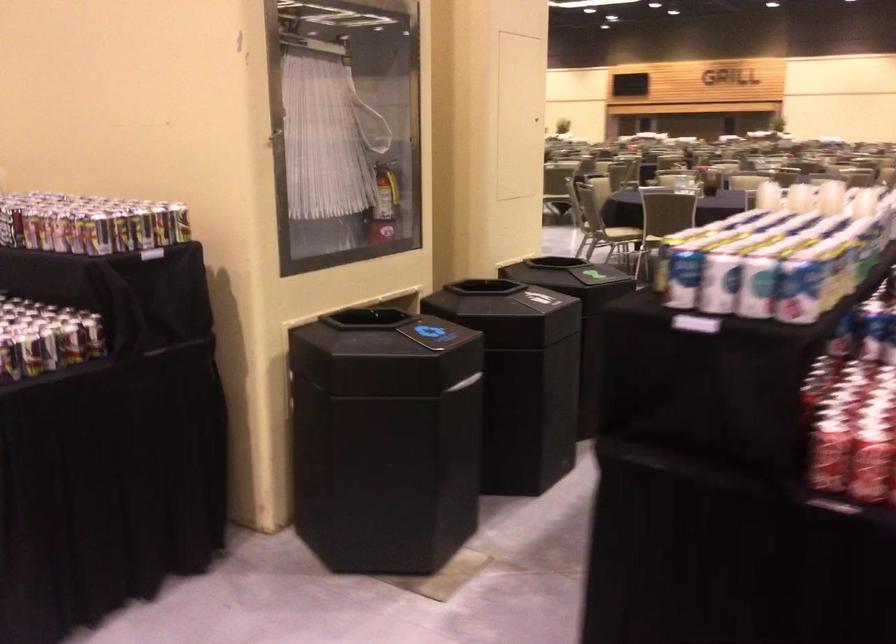
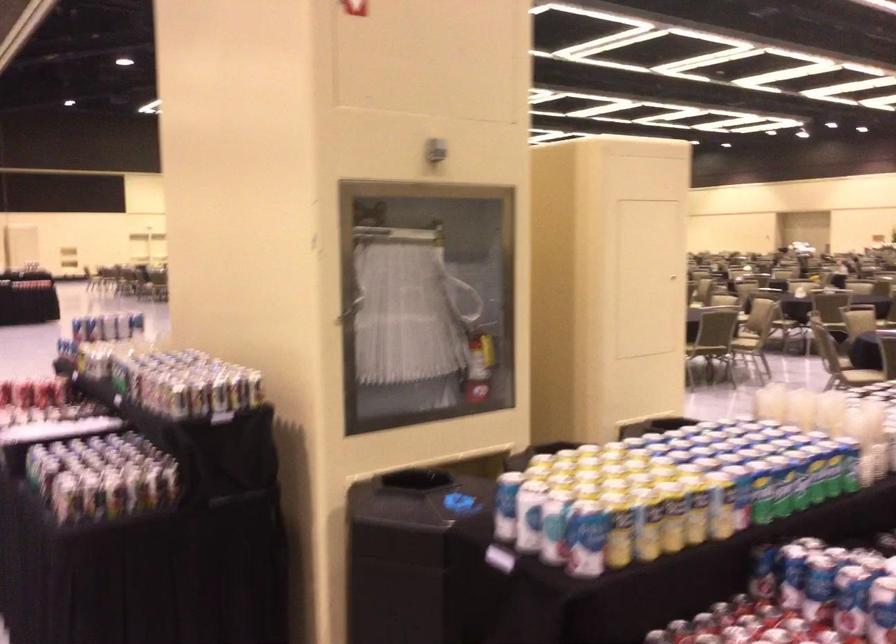
Question: The images are taken continuously from a first-person perspective. In which direction are you moving?

Choices:
 (A) Left
 (B) Right
 (C) Forward
 (D) Backward

Answer: (B)